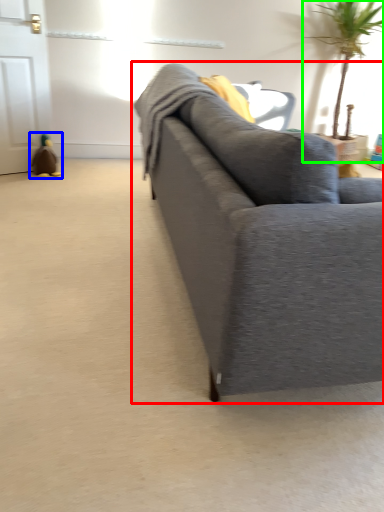
Question: Which is nearer to the studio couch (highlighted by a red box)? toy (highlighted by a blue box) or houseplant (highlighted by a green box).

Choices:
 (A) toy
 (B) houseplant

Answer: (A)